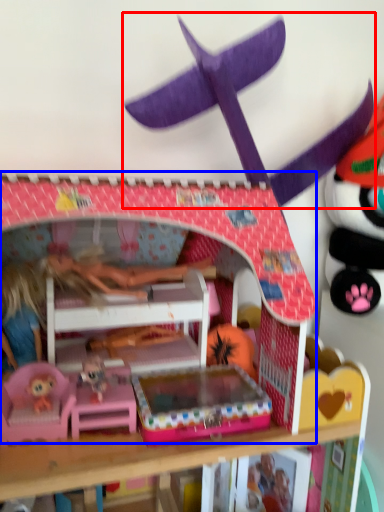
Question: Among these objects, which one is farthest to the camera, toy (highlighted by a red box) or bunk bed (highlighted by a blue box)?

Choices:
 (A) toy
 (B) bunk bed

Answer: (A)